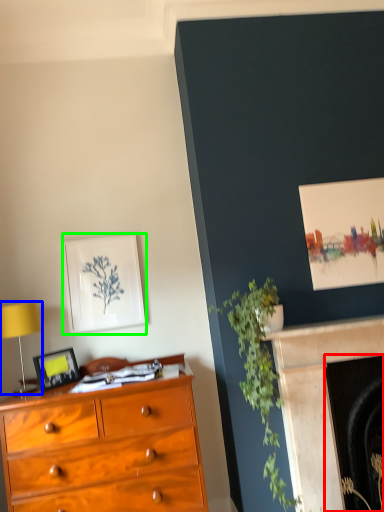
Question: Which object is positioned farthest from fireplace (highlighted by a red box)? Select from table lamp (highlighted by a blue box) and picture frame (highlighted by a green box).

Choices:
 (A) table lamp
 (B) picture frame

Answer: (A)